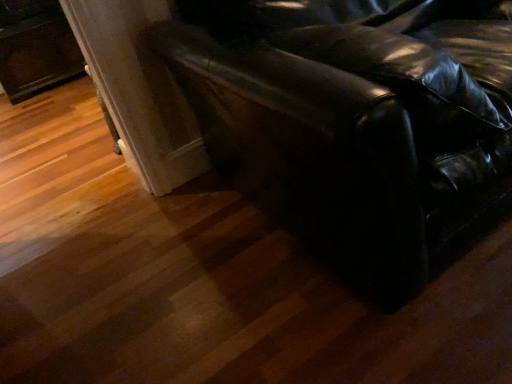
Measure the distance between glossy black leather couch at center and camera.

glossy black leather couch at center and camera are 29.95 inches apart from each other.

Locate an element on the screen. The width and height of the screenshot is (512, 384). glossy black leather couch at center is located at coordinates (354, 123).

What do you see at coordinates (354, 123) in the screenshot? I see `glossy black leather couch at center` at bounding box center [354, 123].

This screenshot has width=512, height=384. I want to click on glossy black leather couch at center, so coord(354,123).